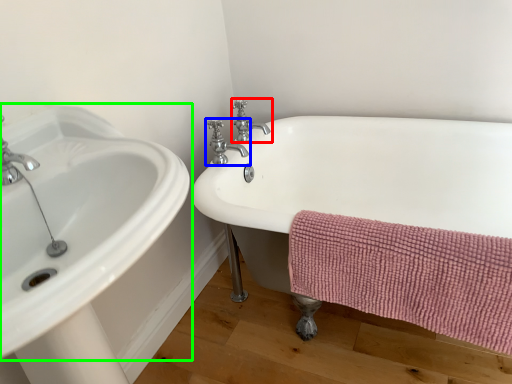
Question: Based on their relative distances, which object is farther from tap (highlighted by a red box)? Choose from tap (highlighted by a blue box) and sink (highlighted by a green box).

Choices:
 (A) tap
 (B) sink

Answer: (B)